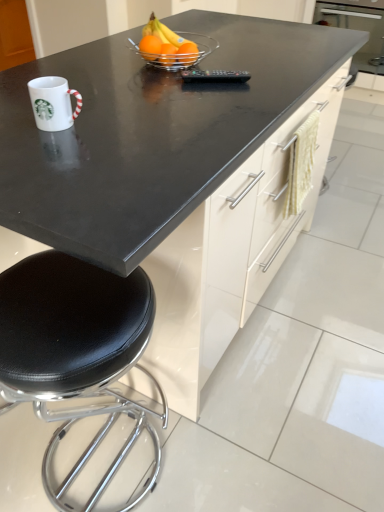
This screenshot has width=384, height=512. I want to click on free region on the left part of white glossy mug at left, so click(x=17, y=119).